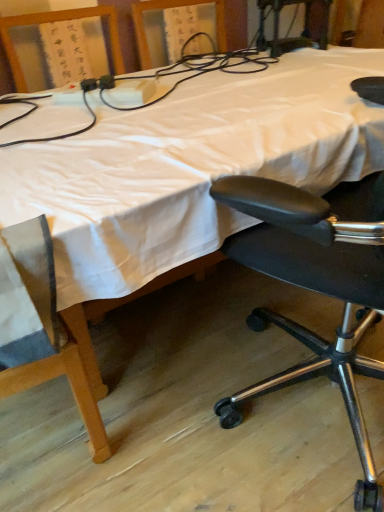
Identify the location of white plastic power strip at upper left. click(164, 75).

The width and height of the screenshot is (384, 512). What do you see at coordinates (187, 172) in the screenshot?
I see `white fabric bed at center` at bounding box center [187, 172].

Identify the location of white plastic power strip at upper left. This screenshot has width=384, height=512. (164, 75).

Can you confirm if white plastic power strip at upper left is positioned to the right of black leather office chair at right?

No, white plastic power strip at upper left is not to the right of black leather office chair at right.

Does white plastic power strip at upper left have a smaller size compared to black leather office chair at right?

Yes, white plastic power strip at upper left is smaller than black leather office chair at right.

Can you tell me how much white plastic power strip at upper left and black leather office chair at right differ in facing direction?

160 degrees.

In the image, is white plastic power strip at upper left positioned in front of or behind black leather office chair at right?

white plastic power strip at upper left is behind black leather office chair at right.

Considering the sizes of objects white plastic power strip at upper left and white fabric bed at center in the image provided, who is smaller, white plastic power strip at upper left or white fabric bed at center?

With smaller size is white plastic power strip at upper left.

From the picture: Is white plastic power strip at upper left placed right next to white fabric bed at center?

No, white plastic power strip at upper left is not beside white fabric bed at center.

Which is behind, white plastic power strip at upper left or white fabric bed at center?

white plastic power strip at upper left.

Is point (194, 72) farther from viewer compared to point (8, 206)?

Yes, point (194, 72) is behind point (8, 206).

Visually, is black leather office chair at right positioned to the left or to the right of white fabric bed at center?

In the image, black leather office chair at right appears on the right side of white fabric bed at center.

From their relative heights in the image, would you say black leather office chair at right is taller or shorter than white fabric bed at center?

Considering their sizes, black leather office chair at right has more height than white fabric bed at center.

Consider the image. How different are the orientations of black leather office chair at right and white fabric bed at center in degrees?

They differ by 164 degrees in their facing directions.

Is white fabric bed at center surrounded by black leather office chair at right?

No, white fabric bed at center is not inside black leather office chair at right.

Considering the relative sizes of white fabric bed at center and white plastic power strip at upper left in the image provided, is white fabric bed at center bigger than white plastic power strip at upper left?

Yes, white fabric bed at center is bigger than white plastic power strip at upper left.

Based on the photo, is white fabric bed at center completely or partially outside of white plastic power strip at upper left?

Yes, white fabric bed at center is not within white plastic power strip at upper left.

Locate an element on the screen. This screenshot has width=384, height=512. bed that is below the white plastic power strip at upper left (from the image's perspective) is located at coordinates (187, 172).

From a real-world perspective, is white fabric bed at center physically located above or below white plastic power strip at upper left?

white fabric bed at center is situated lower than white plastic power strip at upper left in the real world.

From the image's perspective, is white fabric bed at center above or below black leather office chair at right?

From the image's perspective, white fabric bed at center appears above black leather office chair at right.

From a real-world perspective, is white fabric bed at center located beneath black leather office chair at right?

Indeed, from a real-world perspective, white fabric bed at center is positioned beneath black leather office chair at right.

Is white fabric bed at center surrounding black leather office chair at right?

Yes.

Can you confirm if white fabric bed at center is positioned to the right of black leather office chair at right?

No, white fabric bed at center is not to the right of black leather office chair at right.

Can you tell me how much black leather office chair at right and white plastic power strip at upper left differ in facing direction?

They differ by 160 degrees in their facing directions.

Who is taller, black leather office chair at right or white plastic power strip at upper left?

Standing taller between the two is black leather office chair at right.

Which point is more distant from viewer, (314, 275) or (101, 98)?

The point (101, 98) is more distant.

From the image's perspective, between black leather office chair at right and white plastic power strip at upper left, which one is located above?

white plastic power strip at upper left.

Image resolution: width=384 pixels, height=512 pixels. What are the coordinates of `twin that is on the left side of black leather office chair at right` in the screenshot? It's located at (164, 75).

This screenshot has height=512, width=384. I want to click on twin that is above the white fabric bed at center (from a real-world perspective), so click(164, 75).

Which object lies further to the anchor point white fabric bed at center, black leather office chair at right or white plastic power strip at upper left?

black leather office chair at right.

Estimate the real-world distances between objects in this image. Which object is closer to white plastic power strip at upper left, white fabric bed at center or black leather office chair at right?

white fabric bed at center.

When comparing their distances from black leather office chair at right, does white plastic power strip at upper left or white fabric bed at center seem further?

white plastic power strip at upper left lies further to black leather office chair at right than the other object.

From the image, which object appears to be nearer to white fabric bed at center, white plastic power strip at upper left or black leather office chair at right?

Among the two, white plastic power strip at upper left is located nearer to white fabric bed at center.

Based on their spatial positions, is white fabric bed at center or white plastic power strip at upper left further from black leather office chair at right?

white plastic power strip at upper left is further to black leather office chair at right.

Based on their spatial positions, is black leather office chair at right or white fabric bed at center further from white plastic power strip at upper left?

black leather office chair at right.

You are a GUI agent. You are given a task and a screenshot of the screen. Output one action in this format:
    pyautogui.click(x=<x>, y=<y>)
    Task: Click on the bed between black leather office chair at right and white plastic power strip at upper left from front to back
    This screenshot has height=512, width=384.
    Given the screenshot: What is the action you would take?
    pyautogui.click(x=187, y=172)